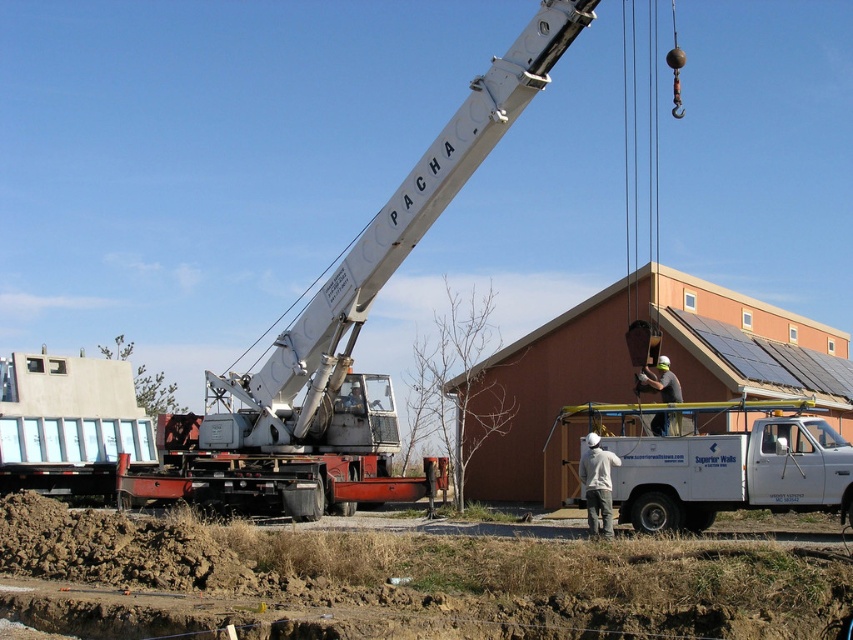
Based on the photo, you are a delivery driver approaching the construction site. You need to park your vehicle behind the white matte truck at center so that it is hidden from view of the gray fabric construction worker at center. Is this possible based on the current setup?

The white matte truck at center is in front of gray fabric construction worker at center, so parking behind the white matte truck at center would place your vehicle behind it, blocking the gray fabric construction worker at center from seeing it. Yes, this is possible.

Based on the photo, you are a construction supervisor planning to move the white matte helmet at center to a safer location. Based on the scene, where should you place it so it is not under the white matte truck at center?

The white matte truck at center is above the white matte helmet at center, so to move the white matte helmet at center to a safer location, place it below the white matte truck at center.